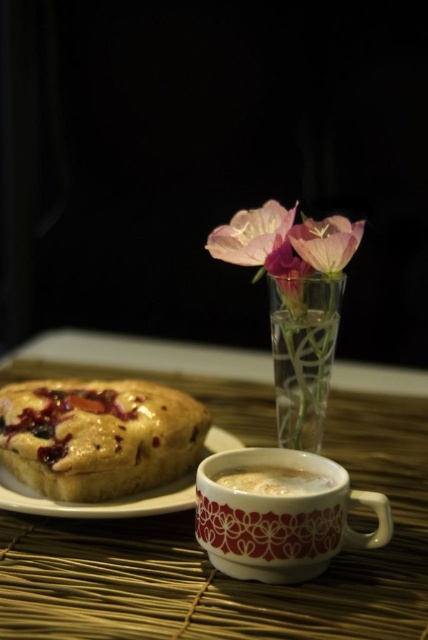
Question: Which object is the farthest from the pink translucent flower at center?

Choices:
 (A) white glossy saucer at lower left
 (B) wooden table at center

Answer: (B)

Question: Which point appears farthest from the camera in this image?

Choices:
 (A) (270, 323)
 (B) (211, 248)

Answer: (A)

Question: Considering the real-world distances, which object is closest to the white glossy saucer at lower left?

Choices:
 (A) white glossy mug at lower center
 (B) pink translucent flower at center
 (C) pink translucent vase at upper center
 (D) wooden table at center

Answer: (A)

Question: Does white glossy saucer at lower left appear under white frothy coffee at center?

Choices:
 (A) yes
 (B) no

Answer: (A)

Question: Is wooden table at center above pink translucent vase at upper center?

Choices:
 (A) yes
 (B) no

Answer: (B)

Question: Observing the image, what is the correct spatial positioning of clear glass vase at center in reference to pink translucent vase at upper center?

Choices:
 (A) right
 (B) left

Answer: (A)